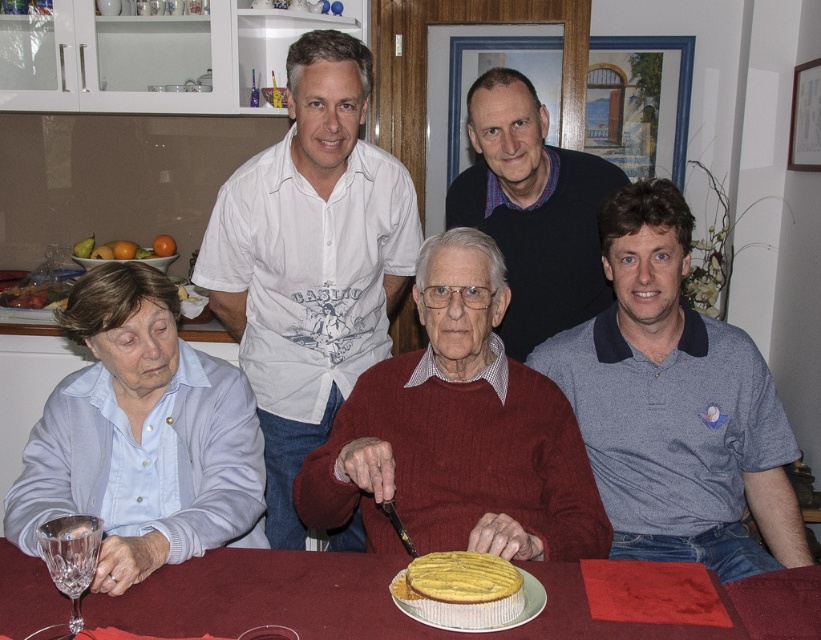
Question: Which of the following is the closest to the observer?

Choices:
 (A) (759, 496)
 (B) (374, 552)
 (C) (746, 598)

Answer: (C)

Question: Which object is the farthest from the white cotton shirt at upper center?

Choices:
 (A) crystal clear wine glass at lower left
 (B) yellow sponge cake at center

Answer: (B)

Question: Which is nearer to the dark blue sweater at upper center?

Choices:
 (A) white cotton shirt at upper center
 (B) crystal clear wine glass at lower left
 (C) smooth wooden table at center

Answer: (A)

Question: Does dark blue sweater at upper center lie in front of crystal clear wine glass at lower left?

Choices:
 (A) yes
 (B) no

Answer: (B)

Question: Is dark blue sweater at upper center positioned behind crystal clear wine glass at lower left?

Choices:
 (A) yes
 (B) no

Answer: (A)

Question: Is smooth wooden table at center above yellow sponge cake at center?

Choices:
 (A) no
 (B) yes

Answer: (A)